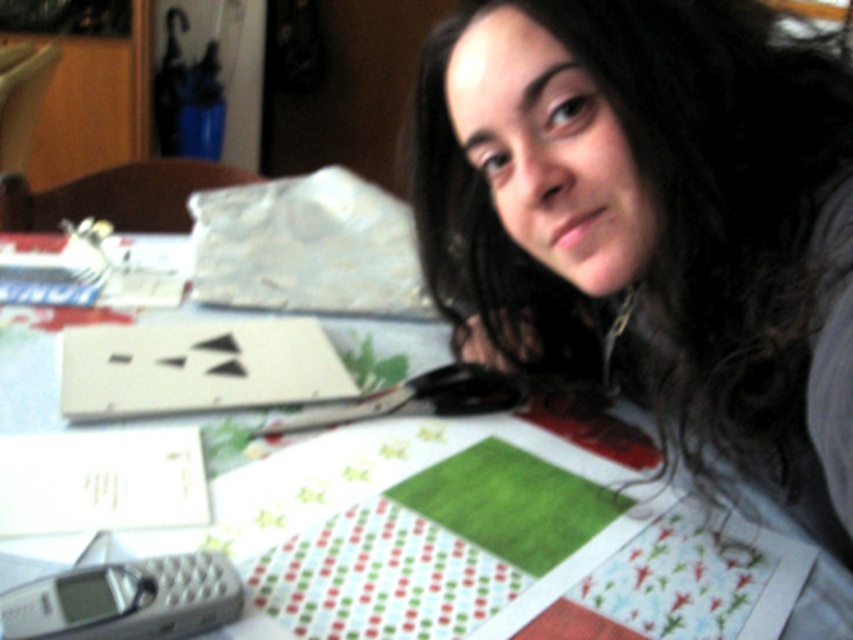
You are organizing items on a table and need to place the gray quilted phone at lower left and the green felt at center. If you want to arrange them side by side without overlapping, which item should be placed first to ensure there is enough space?

The gray quilted phone at lower left has a lesser width compared to the green felt at center. Therefore, you should place the green felt at center first since it takes up more space, ensuring there is enough room for both items when arranged side by side.

You are an interior designer assessing the spatial arrangement of items on a table. The table has a matte black hair at upper center and a green felt at center. Which object takes up more space on the table?

The matte black hair at upper center is larger in size than the green felt at center, so it takes up more space on the table.

You are a person who wants to pick up the gray quilted phone at lower left from where you are standing. Can you reach it without moving your body?

The gray quilted phone at lower left is 15.98 inches away from the viewer, so yes, you can reach it without moving your body since it is within arm reach.